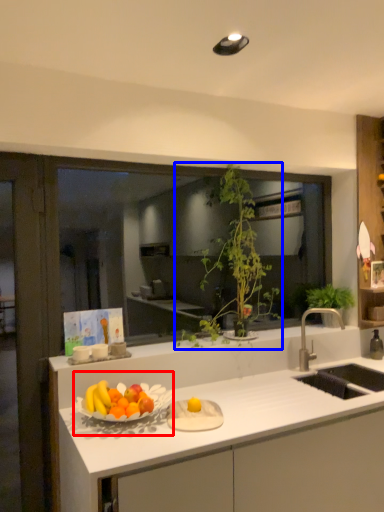
Question: Among these objects, which one is farthest to the camera, fruit dish (highlighted by a red box) or houseplant (highlighted by a blue box)?

Choices:
 (A) fruit dish
 (B) houseplant

Answer: (B)